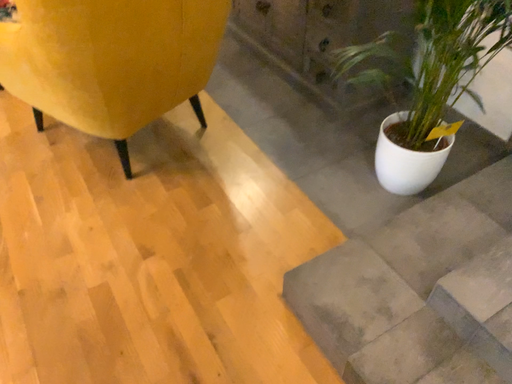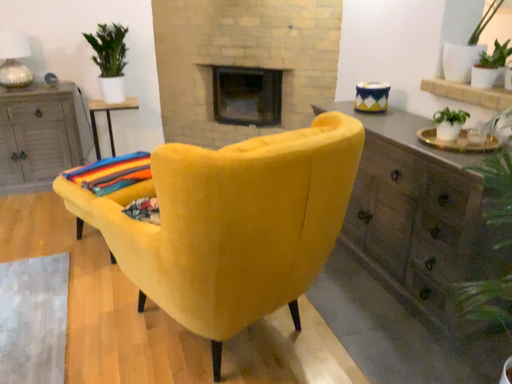
Question: Which way did the camera rotate in the video?

Choices:
 (A) rotated upward
 (B) rotated downward

Answer: (A)